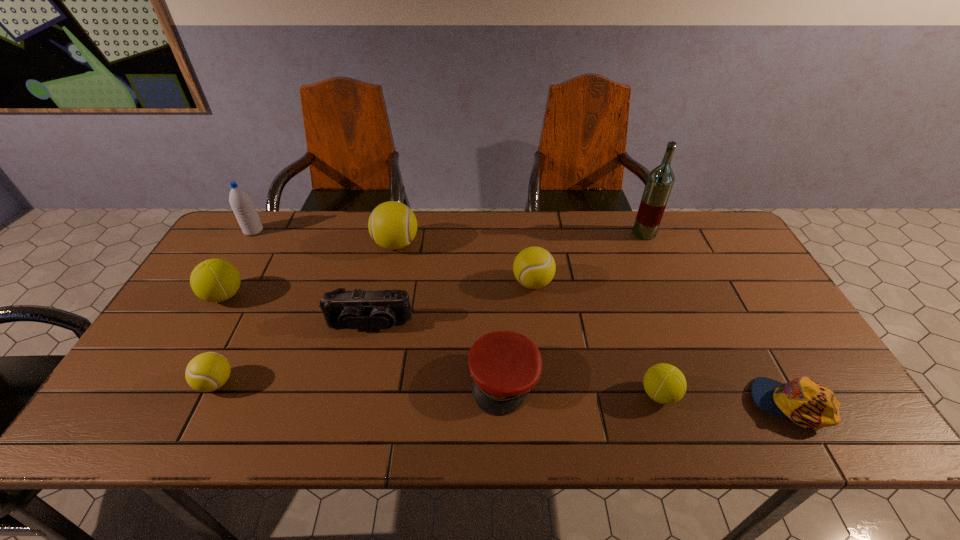
At what (x,y) coordinates should I click in order to perform the action: click on green liquor. Please return your answer as a coordinate pair (x, y). This screenshot has width=960, height=540. Looking at the image, I should click on click(660, 181).

Locate an element on the screen. The image size is (960, 540). the second object from right to left is located at coordinates (660, 181).

What are the coordinates of `blue water bottle` in the screenshot? It's located at (241, 203).

Locate an element on the screen. water bottle is located at coordinates (241, 203).

Image resolution: width=960 pixels, height=540 pixels. Identify the location of the biggest yellow tennis ball. (392, 225).

I want to click on the tallest tennis ball, so click(x=392, y=225).

Find the location of a particular element. Image resolution: width=960 pixels, height=540 pixels. the fourth tennis ball from left to right is located at coordinates (534, 267).

Find the location of `the second nearest yellow tennis ball`. the second nearest yellow tennis ball is located at coordinates (534, 267).

Locate an element on the screen. the left green tennis ball is located at coordinates (215, 280).

Identify the location of the bigger green tennis ball. (215, 280).